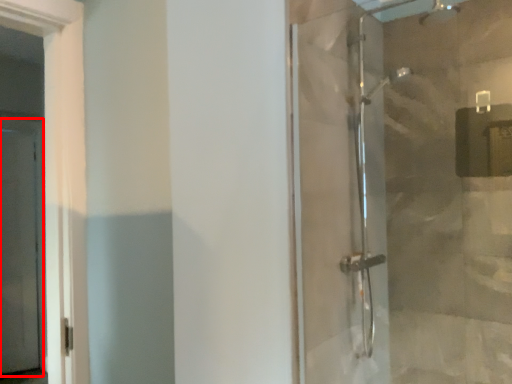
Question: In this image, where is screen door (annotated by the red box) located relative to shower door?

Choices:
 (A) left
 (B) right

Answer: (A)